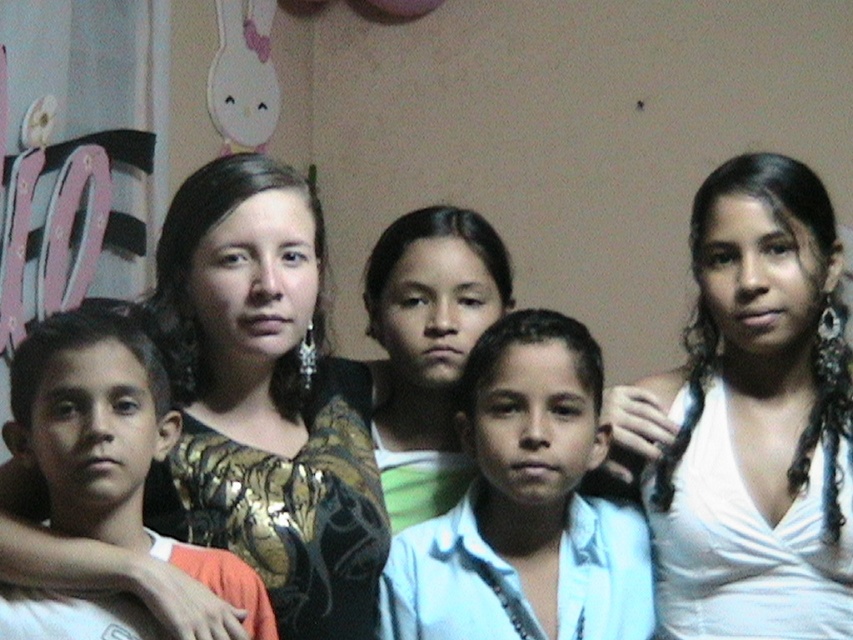
You are standing in front of the group of five people in the image. There are two points marked in the image. The first point is at coordinate point (280, 428) and the second point is at coordinate point (54, 518). From your perspective, which point is closer to you?

A: Point (54, 518) is closer to you because point (280, 428) is behind point (54, 518).

You are a photographer setting up for a family photo. You notice the white satin dress at upper right and the light blue shirt at center. Which clothing item is positioned higher in the image?

The white satin dress at upper right is much taller than the light blue shirt at center, so it is positioned higher in the image.